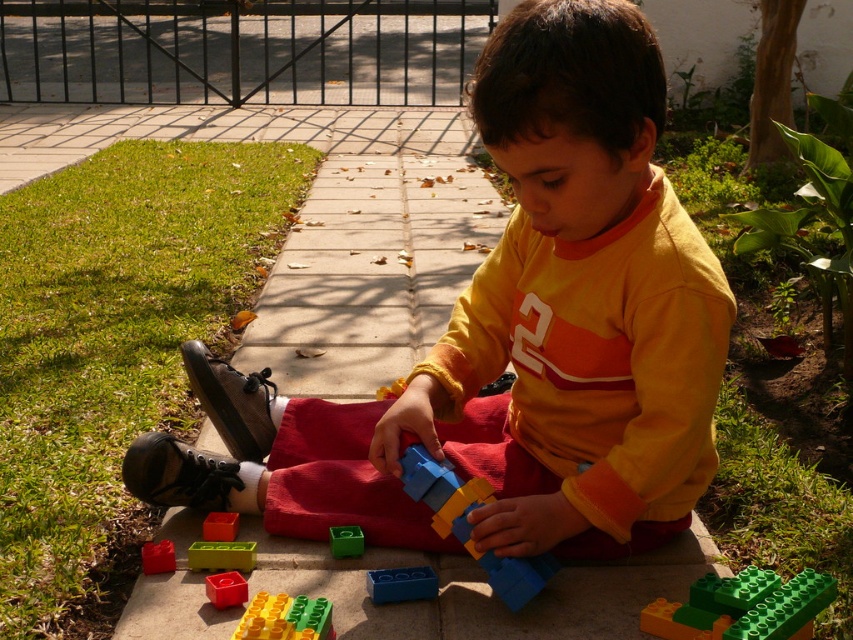
Can you confirm if matte plastic blocks at center is positioned to the right of green plastic block at center?

Correct, you'll find matte plastic blocks at center to the right of green plastic block at center.

Does matte plastic blocks at center have a greater height compared to green plastic block at center?

Yes.

This screenshot has width=853, height=640. What are the coordinates of `matte plastic blocks at center` in the screenshot? It's located at (514, 337).

Identify the location of matte plastic blocks at center. This screenshot has width=853, height=640. (514, 337).

Between bright yellow plastic blocks at lower center and green plastic block at center, which one is positioned higher?

green plastic block at center is above.

Is bright yellow plastic blocks at lower center taller than green plastic block at center?

Yes, bright yellow plastic blocks at lower center is taller than green plastic block at center.

Does point (310, 634) lie behind point (341, 536)?

No, it is in front of (341, 536).

Where is `bright yellow plastic blocks at lower center`? The image size is (853, 640). bright yellow plastic blocks at lower center is located at coordinates (285, 618).

The height and width of the screenshot is (640, 853). In order to click on translucent green plastic blocks at lower center in this screenshot , I will do `click(221, 556)`.

Image resolution: width=853 pixels, height=640 pixels. Find the location of `translucent green plastic blocks at lower center`. translucent green plastic blocks at lower center is located at coordinates (221, 556).